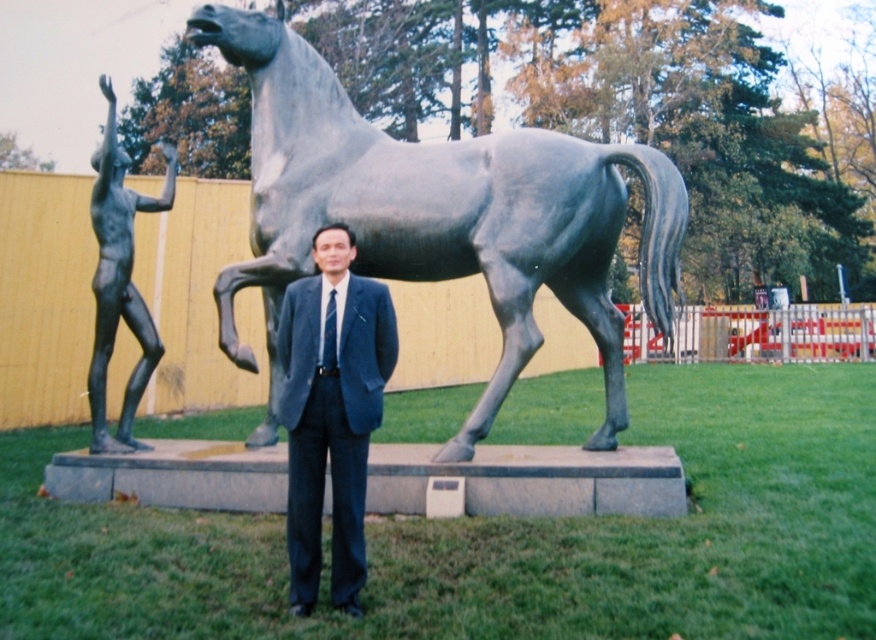
Does bronze horse at center appear over black matte figure at left?

No.

Between bronze horse at center and black matte figure at left, which one has less height?

With less height is bronze horse at center.

Locate an element on the screen. This screenshot has height=640, width=876. bronze horse at center is located at coordinates (436, 216).

Who is shorter, bronze horse at center or blue fabric suit at center?

Standing shorter between the two is blue fabric suit at center.

Who is more distant from viewer, (251, 280) or (287, 349)?

The point (251, 280) is behind.

Identify the location of bronze horse at center. The height and width of the screenshot is (640, 876). (436, 216).

Does blue fabric suit at center have a greater height compared to black matte figure at left?

Incorrect, blue fabric suit at center's height is not larger of black matte figure at left's.

Does blue fabric suit at center appear on the right side of black matte figure at left?

Indeed, blue fabric suit at center is positioned on the right side of black matte figure at left.

Image resolution: width=876 pixels, height=640 pixels. In order to click on blue fabric suit at center in this screenshot , I will do `click(331, 412)`.